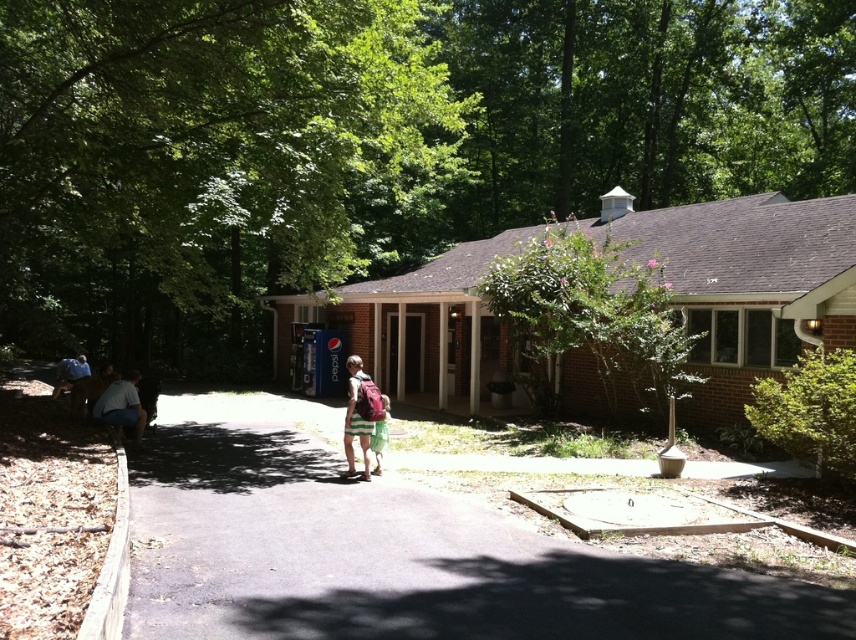
Question: Does green leafy tree at center have a smaller size compared to striped cotton shorts at center?

Choices:
 (A) yes
 (B) no

Answer: (B)

Question: Estimate the real-world distances between objects in this image. Which object is farther from the denim shorts at lower left?

Choices:
 (A) denim jacket at lower left
 (B) dark asphalt pavement at center
 (C) brick gazebo at center
 (D) striped cotton shorts at center

Answer: (C)

Question: Does dark asphalt pavement at center appear over striped cotton shorts at center?

Choices:
 (A) yes
 (B) no

Answer: (B)

Question: Which object is farther from the camera taking this photo?

Choices:
 (A) dark asphalt pavement at center
 (B) denim shorts at lower left

Answer: (B)

Question: Based on their relative distances, which object is farther from the brick gazebo at center?

Choices:
 (A) green leafy tree at center
 (B) denim shorts at lower left
 (C) striped cotton shorts at center

Answer: (B)

Question: Can you confirm if striped cotton shorts at center is positioned below denim shorts at lower left?

Choices:
 (A) no
 (B) yes

Answer: (B)